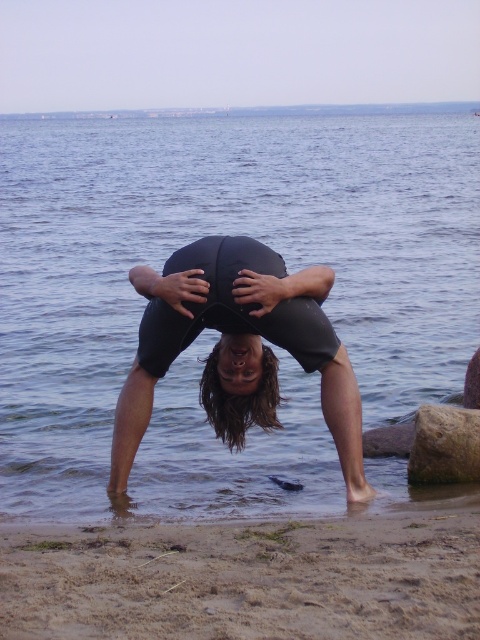
Question: Which of these objects is positioned closest to the blue water at center?

Choices:
 (A) black matte squat at center
 (B) black neoprene wetsuit at center

Answer: (A)

Question: Does blue water at center have a smaller size compared to black matte squat at center?

Choices:
 (A) no
 (B) yes

Answer: (A)

Question: Which object appears farthest from the camera in this image?

Choices:
 (A) black matte squat at center
 (B) blue water at center

Answer: (B)

Question: Which point appears closest to the camera in this image?

Choices:
 (A) (389, 570)
 (B) (115, 429)
 (C) (224, 316)
 (D) (229, 452)

Answer: (A)

Question: Does blue water at center appear over black neoprene wetsuit at center?

Choices:
 (A) yes
 (B) no

Answer: (A)

Question: Is brown sandy beach at lower left thinner than black matte squat at center?

Choices:
 (A) no
 (B) yes

Answer: (A)